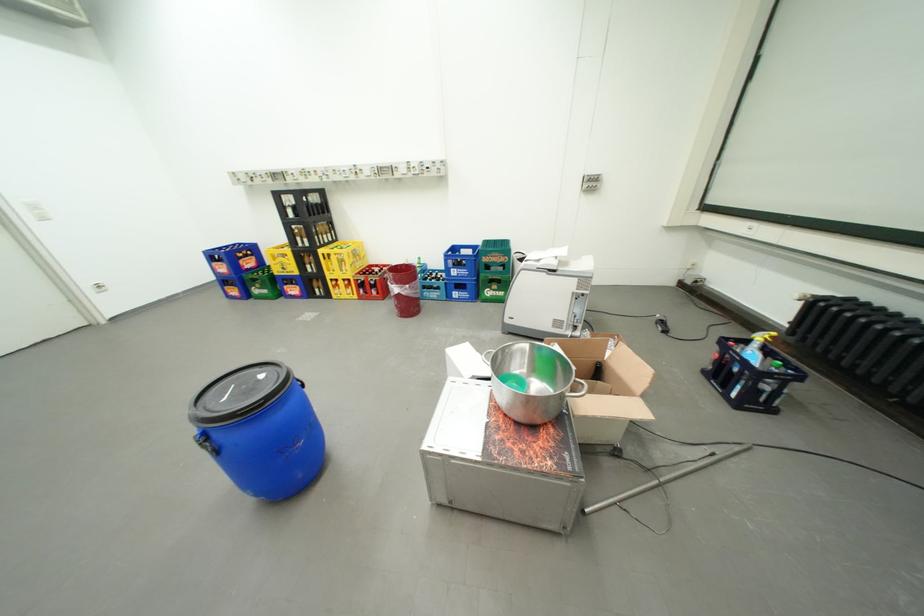
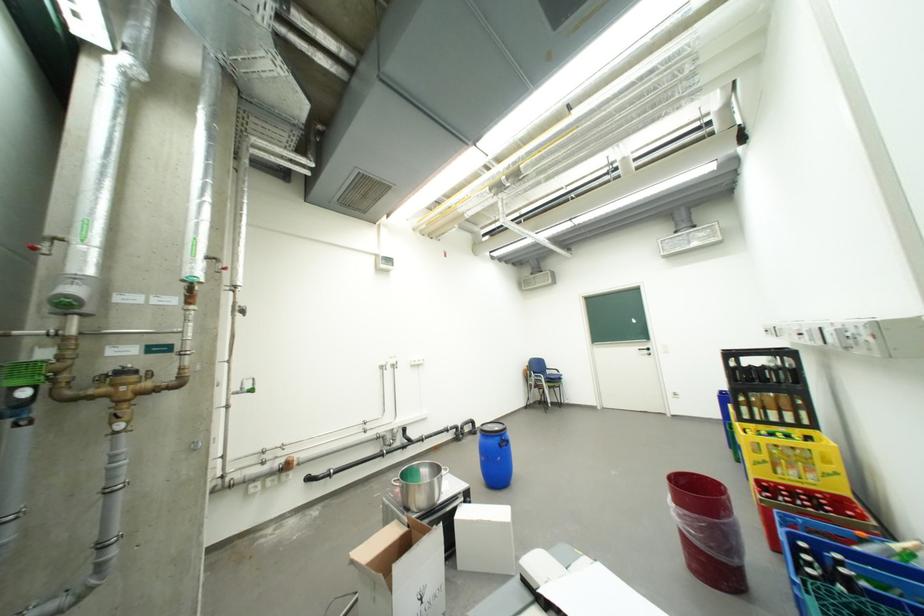
In the second image, find the point that corresponds to (x=371, y=268) in the first image.

(810, 484)